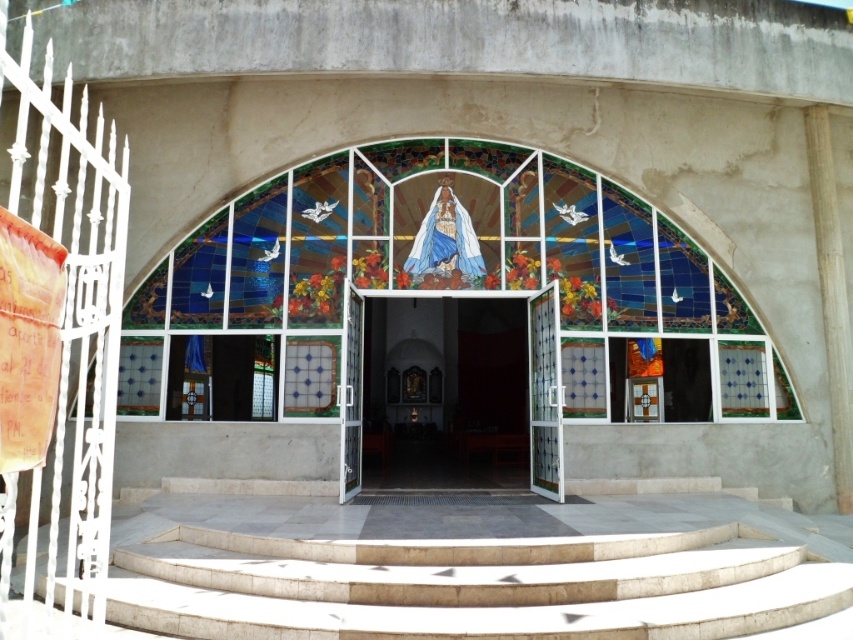
Question: Is white stone stairs at center above white glass doors at center?

Choices:
 (A) yes
 (B) no

Answer: (B)

Question: Which point is farther to the camera?

Choices:
 (A) (389, 545)
 (B) (598, 404)

Answer: (B)

Question: Observing the image, what is the correct spatial positioning of white stone stairs at center in reference to white glass doors at center?

Choices:
 (A) below
 (B) above

Answer: (A)

Question: Which of the following is the closest to the observer?

Choices:
 (A) [524, 408]
 (B) [440, 280]

Answer: (B)

Question: Can you confirm if white stone stairs at center is positioned to the left of stained glass mosaic at center?

Choices:
 (A) yes
 (B) no

Answer: (B)

Question: Which point is farther from the camera taking this photo?

Choices:
 (A) (511, 586)
 (B) (352, 204)
 (C) (454, 317)

Answer: (C)